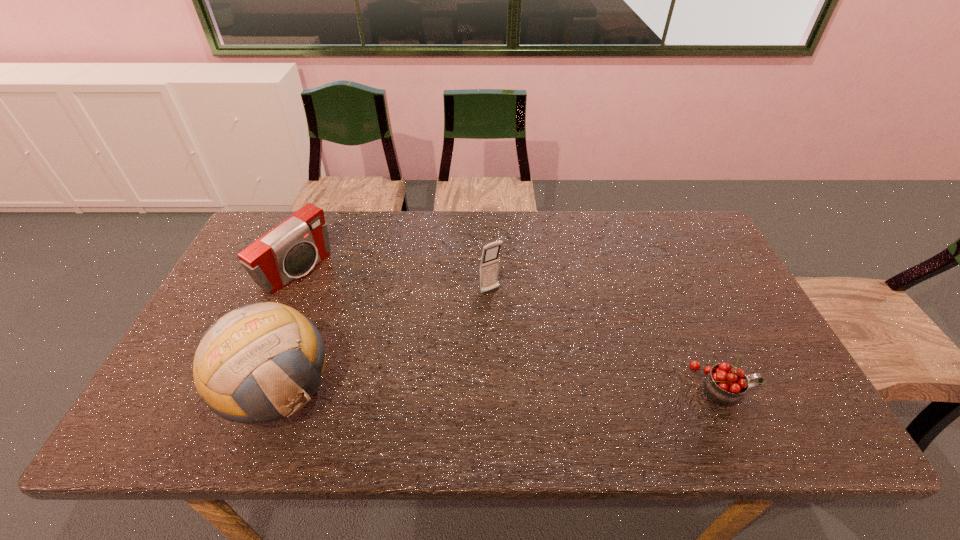
Identify the location of object present at the near left corner. The height and width of the screenshot is (540, 960). (261, 362).

The height and width of the screenshot is (540, 960). In order to click on object present at the near right corner in this screenshot , I will do [x=725, y=384].

This screenshot has width=960, height=540. I want to click on vacant region at the far edge of the desktop, so click(x=419, y=251).

At what (x,y) coordinates should I click in order to perform the action: click on free region at the far right corner. Please return your answer as a coordinate pair (x, y). Looking at the image, I should click on (679, 237).

This screenshot has height=540, width=960. I want to click on blank region between the second object from right to left and the camera, so click(x=394, y=281).

Locate an element on the screen. unoccupied area between the tallest object and the third object from left to right is located at coordinates (384, 341).

The image size is (960, 540). Find the location of `vacant area that lies between the third object from left to right and the camera`. vacant area that lies between the third object from left to right and the camera is located at coordinates (394, 281).

Locate an element on the screen. empty space that is in between the camera and the rightmost object is located at coordinates (509, 328).

Locate an element on the screen. The height and width of the screenshot is (540, 960). unoccupied area between the camera and the shortest object is located at coordinates (509, 328).

Locate an element on the screen. free area in between the rightmost object and the volleyball is located at coordinates (500, 388).